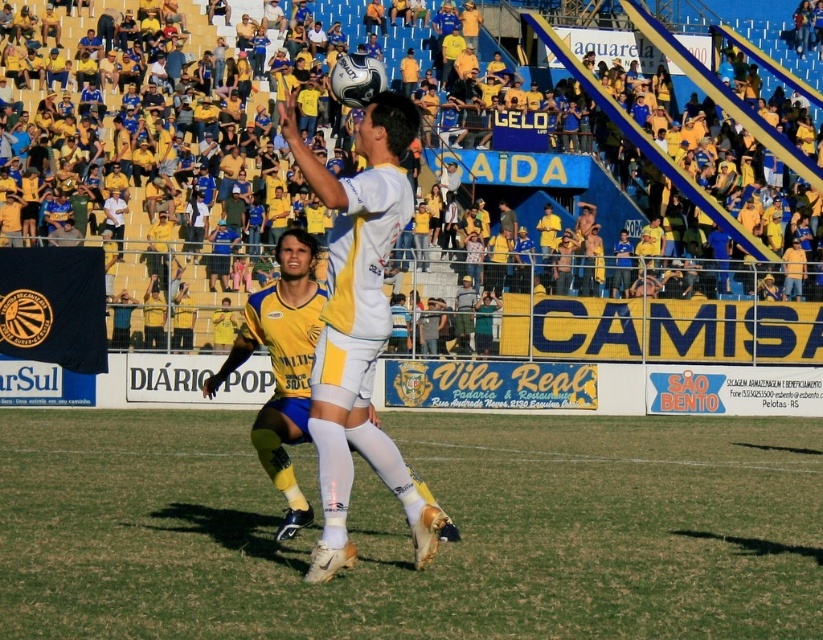
Question: Does green grass at center have a smaller size compared to white matte soccer player at center?

Choices:
 (A) no
 (B) yes

Answer: (A)

Question: Which point is closer to the camera?

Choices:
 (A) white matte soccer player at center
 (B) green grass at center

Answer: (B)

Question: Which of the following is the farthest from the observer?

Choices:
 (A) pyautogui.click(x=382, y=109)
 (B) pyautogui.click(x=17, y=461)

Answer: (B)

Question: Which point is closer to the camera?

Choices:
 (A) (329, 336)
 (B) (477, 436)

Answer: (A)

Question: Is green grass at center to the right of white matte soccer player at center from the viewer's perspective?

Choices:
 (A) yes
 (B) no

Answer: (A)

Question: Is green grass at center wider than white matte soccer player at center?

Choices:
 (A) yes
 (B) no

Answer: (A)